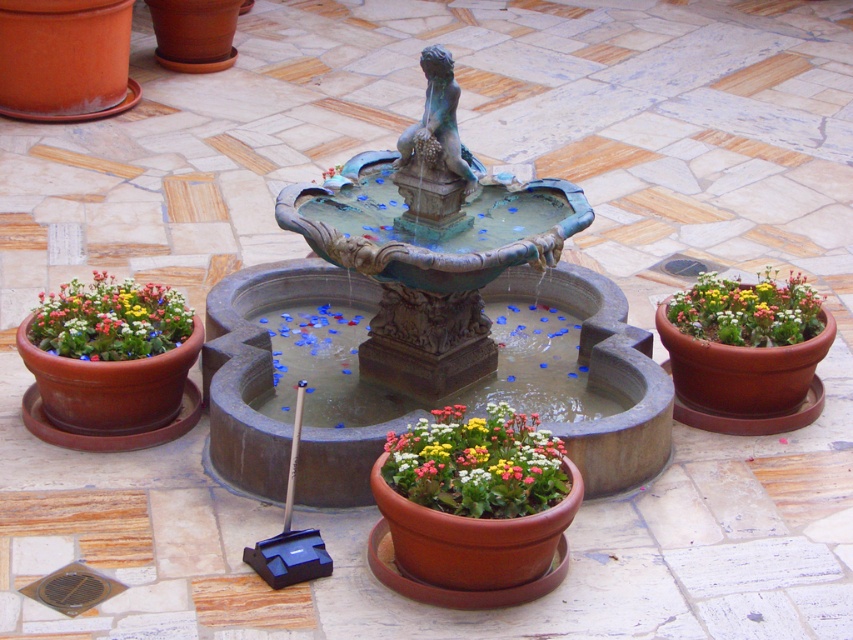
Which of these two, matte terracotta pot at center or matte terracotta pot at right, stands shorter?

matte terracotta pot at right is shorter.

What do you see at coordinates (477, 464) in the screenshot?
I see `matte terracotta pot at center` at bounding box center [477, 464].

Find the location of `matte terracotta pot at center`. matte terracotta pot at center is located at coordinates (477, 464).

Between point (215, 404) and point (123, 314), which one is positioned behind?

The point (123, 314) is behind.

Between green patina fountain at center and matte terracotta pot at left, which one has less height?

matte terracotta pot at left

Which is behind, point (415, 346) or point (54, 348)?

The point (415, 346) is more distant.

Identify the location of green patina fountain at center. The width and height of the screenshot is (853, 640). (431, 298).

Is green patina fountain at center smaller than matte terracotta pot at center?

No, green patina fountain at center is not smaller than matte terracotta pot at center.

Can you confirm if green patina fountain at center is taller than matte terracotta pot at center?

Yes.

Between point (480, 166) and point (434, 506), which one is positioned in front?

Point (434, 506) is in front.

You are a GUI agent. You are given a task and a screenshot of the screen. Output one action in this format:
    pyautogui.click(x=<x>, y=<y>)
    Task: Click on the green patina fountain at center
    
    Given the screenshot: What is the action you would take?
    pyautogui.click(x=431, y=298)